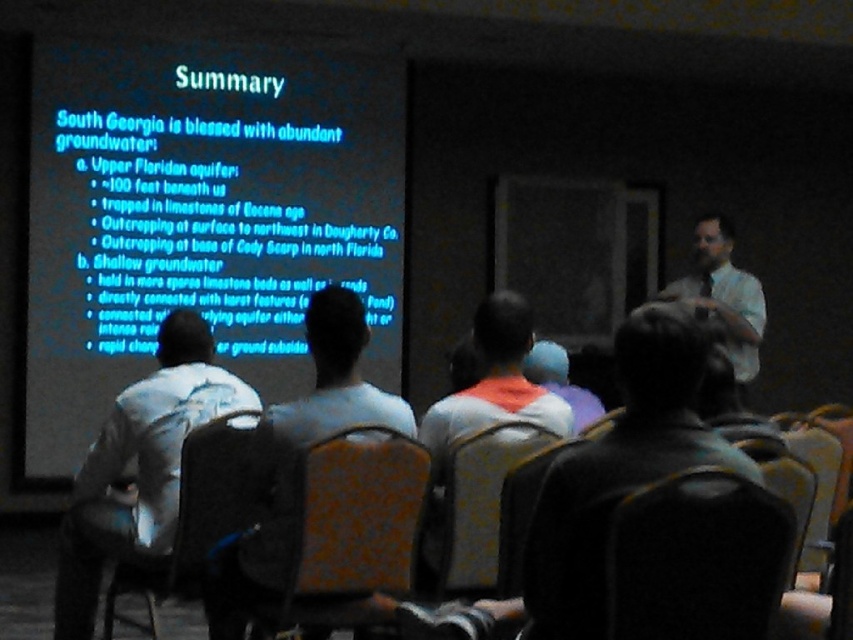
You are a photographer positioned at the back of the room. You want to take a photo of the white shirt at right and the black fabric chair at lower right. Which object will appear smaller in the photo?

The black fabric chair at lower right will appear smaller in the photo because it has a lesser height compared to the white shirt at right.

You are sitting in the presentation room and want to move to the front to ask a question. There is a patterned fabric chair at center in your way. Can you walk around it easily?

The patterned fabric chair at center is located at point (350,531), so yes, you can walk around it easily since it is positioned centrally and not blocking the entire path.